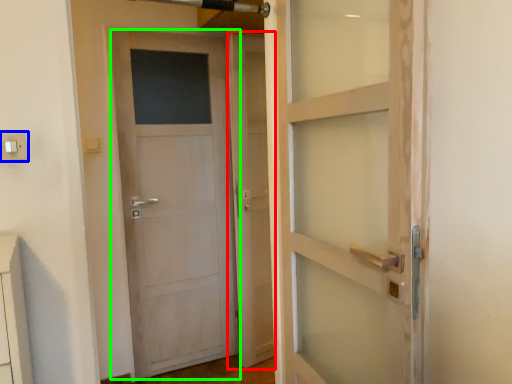
Question: Considering the real-world distances, which object is farthest from screen door (highlighted by a red box)? electric outlet (highlighted by a blue box) or door (highlighted by a green box)?

Choices:
 (A) electric outlet
 (B) door

Answer: (A)